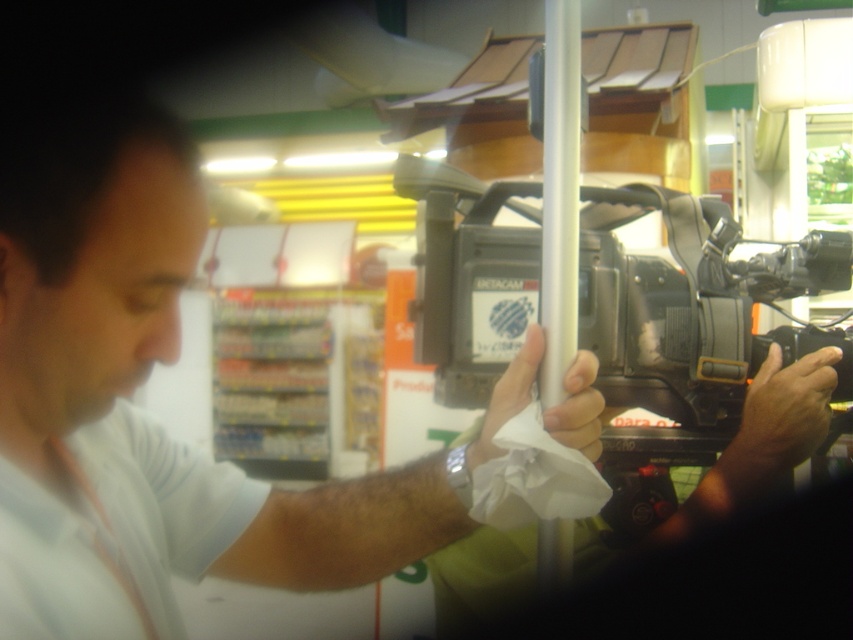
Question: Can you confirm if black plastic video camera at center is wider than white plastic pole at center?

Choices:
 (A) yes
 (B) no

Answer: (A)

Question: Does white plastic pole at center lie in front of white matte paper towel at center?

Choices:
 (A) yes
 (B) no

Answer: (B)

Question: Estimate the real-world distances between objects in this image. Which object is farther from the black plastic video camera at center?

Choices:
 (A) white plastic pole at center
 (B) smooth skin hand at center

Answer: (A)

Question: Among these objects, which one is farthest from the camera?

Choices:
 (A) black plastic video camera at center
 (B) white plastic pole at center
 (C) smooth skin hand at center
 (D) white matte paper towel at center

Answer: (C)

Question: Can you confirm if white plastic pole at center is positioned below white matte paper towel at center?

Choices:
 (A) yes
 (B) no

Answer: (B)

Question: Among these objects, which one is nearest to the camera?

Choices:
 (A) white matte paper towel at center
 (B) white plastic pole at center
 (C) black plastic video camera at center

Answer: (A)